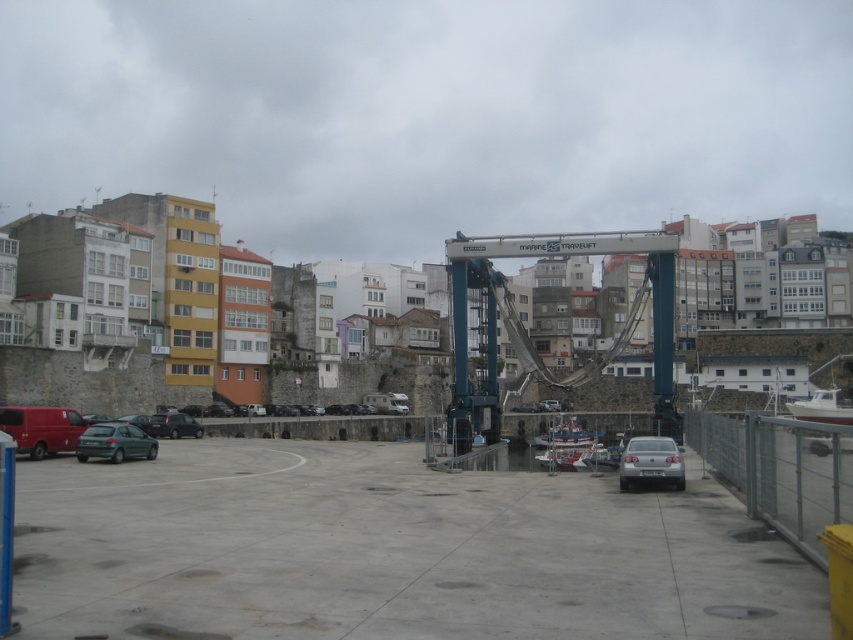
Question: Does blue metallic crane at center have a larger size compared to green matte hatchback at lower left?

Choices:
 (A) yes
 (B) no

Answer: (A)

Question: Does gray concrete parking lot at center appear on the right side of matte red van at lower left?

Choices:
 (A) yes
 (B) no

Answer: (A)

Question: Which of the following is the closest to the observer?

Choices:
 (A) gray concrete parking lot at center
 (B) blue metallic crane at center

Answer: (A)

Question: Among these objects, which one is farthest from the camera?

Choices:
 (A) green matte hatchback at lower left
 (B) silver metallic car at lower right

Answer: (A)

Question: Considering the relative positions of matte red van at lower left and silver metallic car at lower right in the image provided, where is matte red van at lower left located with respect to silver metallic car at lower right?

Choices:
 (A) above
 (B) below

Answer: (A)

Question: Based on their relative distances, which object is nearer to the matte black car at lower left?

Choices:
 (A) silver metallic car at lower right
 (B) matte red van at lower left
 (C) gray concrete parking lot at center
 (D) green matte hatchback at lower left

Answer: (D)